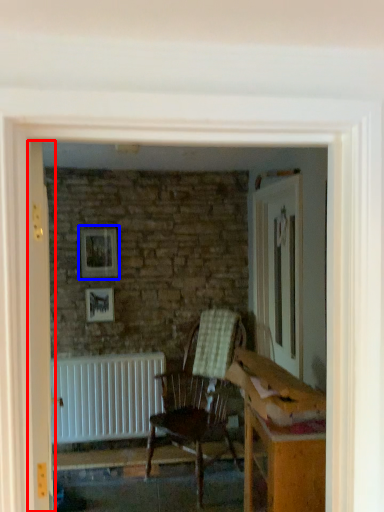
Question: Which point is closer to the camera, door (highlighted by a red box) or picture frame (highlighted by a blue box)?

Choices:
 (A) door
 (B) picture frame

Answer: (A)